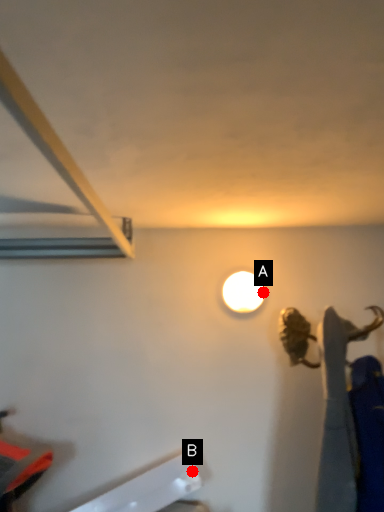
Question: Two points are circled on the image, labeled by A and B beside each circle. Among these points, which one is farthest from the camera?

Choices:
 (A) A is further
 (B) B is further

Answer: (A)